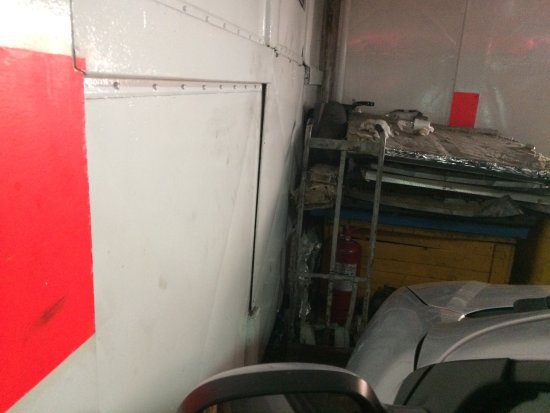
You are a GUI agent. You are given a task and a screenshot of the screen. Output one action in this format:
    pyautogui.click(x=<x>, y=<y>)
    Task: Click on the wooden base
    The height and width of the screenshot is (413, 550).
    Given the screenshot: What is the action you would take?
    pyautogui.click(x=437, y=259)